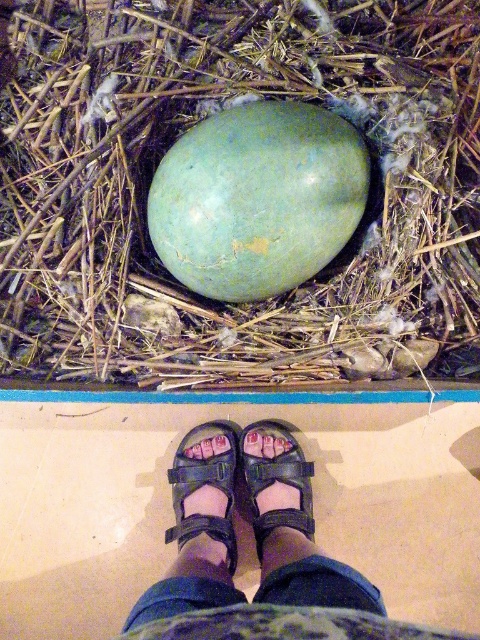
Question: Which object appears farthest from the camera in this image?

Choices:
 (A) green matte egg at center
 (B) greenish-blue egg at center

Answer: (B)

Question: Is greenish-blue egg at center positioned in front of green matte egg at center?

Choices:
 (A) no
 (B) yes

Answer: (A)

Question: Does black leather sandals at lower center appear over black leather sandal at center?

Choices:
 (A) no
 (B) yes

Answer: (A)

Question: Is black leather sandals at lower center below black leather sandal at center?

Choices:
 (A) no
 (B) yes

Answer: (B)

Question: Which of the following is the closest to the observer?

Choices:
 (A) black leather sandals at lower center
 (B) green matte egg at center
 (C) greenish-blue egg at center
 (D) black fabric sandal at lower center

Answer: (A)

Question: Which object is the farthest from the green matte egg at center?

Choices:
 (A) greenish-blue egg at center
 (B) black leather sandals at lower center
 (C) black fabric sandal at lower center

Answer: (C)